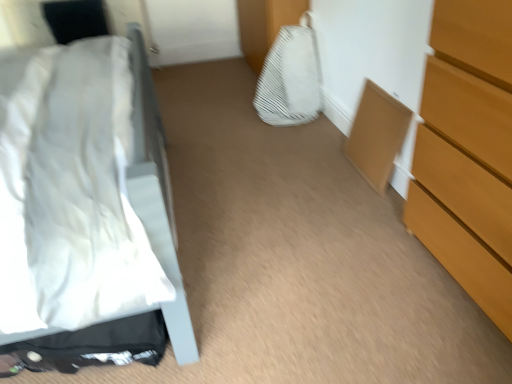
Question: In terms of height, does white matte bed at left look taller or shorter compared to matte wood cabinet at lower right?

Choices:
 (A) tall
 (B) short

Answer: (A)

Question: From the image's perspective, is white matte bed at left above or below matte wood cabinet at lower right?

Choices:
 (A) below
 (B) above

Answer: (A)

Question: Based on their relative distances, which object is farther from the wooden chest of drawers at right?

Choices:
 (A) white matte bed at left
 (B) white textured fabric at center
 (C) matte wood cabinet at lower right

Answer: (B)

Question: Which is farther from the white textured fabric at center?

Choices:
 (A) matte wood cabinet at lower right
 (B) white matte bed at left
 (C) wooden chest of drawers at right

Answer: (C)